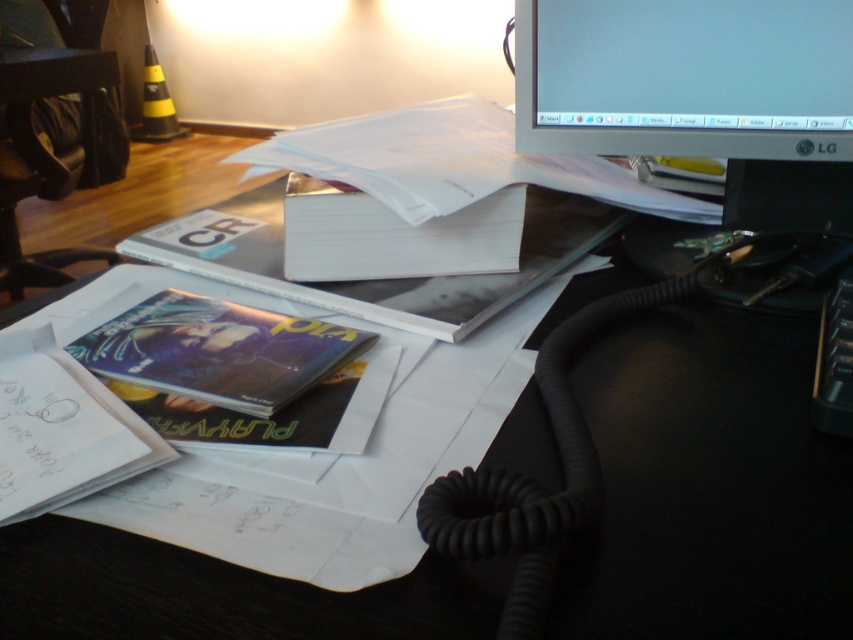
You are organizing the desk and want to place both the matte black monitor at upper right and the matte plastic book at lower left on a shelf. The shelf has a height limit of 20 cm. Can both items fit vertically on the shelf without exceeding the height limit?

The matte black monitor at upper right has a larger size compared to matte plastic book at lower left. However, the exact heights of both items are not provided in the description. Therefore, it is uncertain if they can fit vertically on the shelf with the 20 cm height limit.

You are organizing the desk and want to place both the matte black monitor at upper right and the metallic glossy book at center on a shelf. Which item should you place first to ensure they both fit side by side?

The metallic glossy book at center is narrower than the matte black monitor at upper right. Place the metallic glossy book at center first, then the matte black monitor at upper right to accommodate their widths.

You need to place both the metallic glossy book at center and the matte plastic book at lower left into a storage box that can only accommodate the narrower of the two. Which book should you choose?

The matte plastic book at lower left should be chosen because it is narrower than the metallic glossy book at center, making it suitable for the storage box designed for the narrower item.